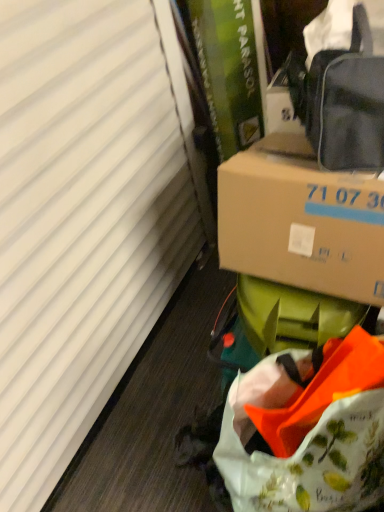
Question: Does point click(249, 187) appear closer or farther from the camera than point click(367, 122)?

Choices:
 (A) farther
 (B) closer

Answer: (A)

Question: From a real-world perspective, is brown cardboard box at center-right physically located above or below matte black bag at upper right?

Choices:
 (A) above
 (B) below

Answer: (B)

Question: Which object is the farthest from the floral printed fabric bag at lower right?

Choices:
 (A) white matte curtain at left
 (B) matte black bag at upper right
 (C) brown cardboard box at center-right

Answer: (A)

Question: Based on their relative distances, which object is nearer to the white matte curtain at left?

Choices:
 (A) brown cardboard box at center-right
 (B) floral printed fabric bag at lower right
 (C) matte black bag at upper right

Answer: (A)